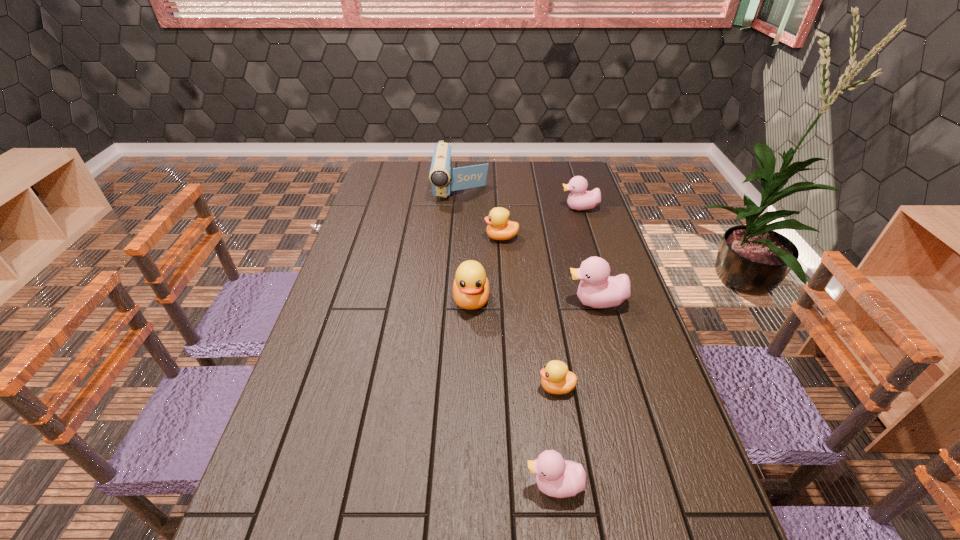
Locate an element on the screen. free point located 0.230m on the face of the second smallest yellow duckling is located at coordinates (419, 238).

Identify the location of vacant region located on the face of the second smallest yellow duckling. (424, 238).

The height and width of the screenshot is (540, 960). I want to click on free location located on the front-facing side of the nearest pink duckling, so click(481, 485).

In order to click on vacant space located 0.100m on the front-facing side of the nearest pink duckling in this screenshot , I will do `click(476, 485)`.

Find the location of a particular element. The image size is (960, 540). vacant point located on the front-facing side of the nearest pink duckling is located at coordinates (402, 485).

Find the location of a particular element. This screenshot has width=960, height=540. vacant space located 0.140m on the face of the shortest duckling is located at coordinates (481, 387).

This screenshot has width=960, height=540. I want to click on free space located on the face of the shortest duckling, so click(407, 387).

Find the location of a particular element. The height and width of the screenshot is (540, 960). blank area located 0.370m on the face of the shortest duckling is located at coordinates (387, 387).

Image resolution: width=960 pixels, height=540 pixels. I want to click on object that is at the far edge, so click(x=440, y=175).

Find the location of `vacant region at the far edge of the desktop`. vacant region at the far edge of the desktop is located at coordinates (423, 166).